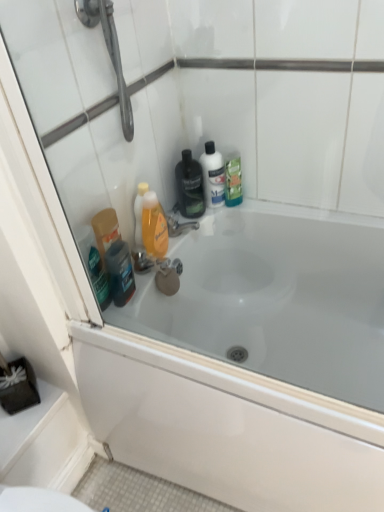
Question: In terms of size, does translucent plastic mouthwash at upper right, which is counted as the 4th mouthwash, starting from the left, appear bigger or smaller than metallic chrome faucet at center?

Choices:
 (A) small
 (B) big

Answer: (B)

Question: From a real-world perspective, is translucent plastic mouthwash at upper right, which is counted as the 4th mouthwash, starting from the left, above or below metallic chrome faucet at center?

Choices:
 (A) below
 (B) above

Answer: (B)

Question: Based on their relative distances, which object is farther from the white glossy mouthwash at center, the 3th mouthwash when ordered from left to right?

Choices:
 (A) shiny dark blue bottle at lower left
 (B) white glossy bathtub at upper center
 (C) translucent plastic mouthwash at upper right, which is counted as the 4th mouthwash, starting from the left
 (D) translucent orange liquid at center, the first mouthwash from the left
 (E) metallic chrome faucet at center

Answer: (B)

Question: Which object is the closest to the white glossy bathtub at upper center?

Choices:
 (A) translucent plastic mouthwash at upper right, the 1th mouthwash from the right
 (B) metallic chrome faucet at center
 (C) white glossy mouthwash at center, the 3th mouthwash when ordered from left to right
 (D) black glossy mouthwash at center, acting as the third mouthwash starting from the right
 (E) shiny dark blue bottle at lower left

Answer: (E)